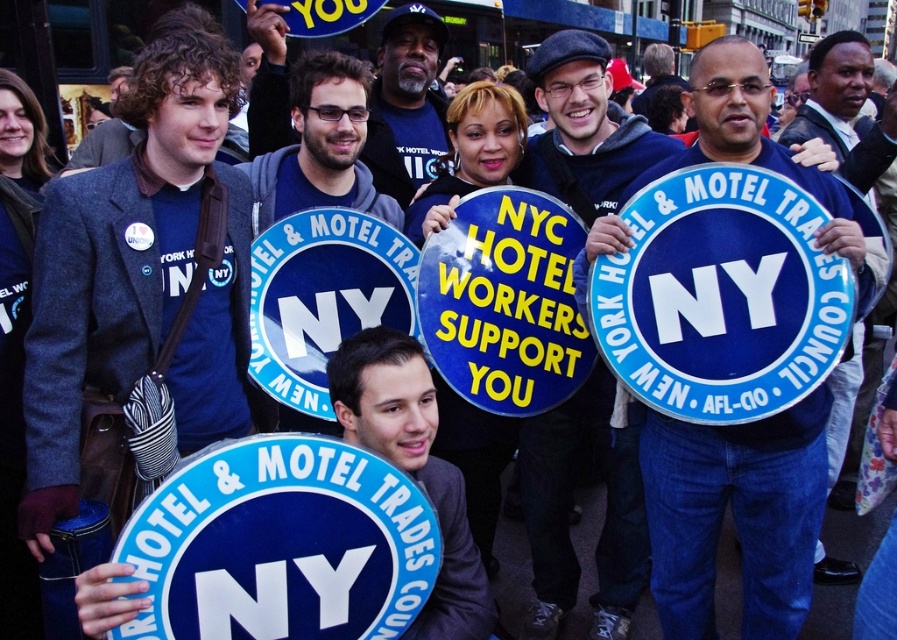
What are the coordinates of `blue matte sign at center` in the screenshot? It's located at (736, 515).

What do you see at coordinates (736, 515) in the screenshot? I see `blue matte sign at center` at bounding box center [736, 515].

Find the location of `blue matte sign at center`. blue matte sign at center is located at coordinates (736, 515).

Does point (802, 173) come closer to viewer compared to point (884, 145)?

That is True.

Can you confirm if blue matte sign at center is positioned to the left of blue fabric shirt at right?

Correct, you'll find blue matte sign at center to the left of blue fabric shirt at right.

At what (x,y) coordinates should I click in order to perform the action: click on blue matte sign at center. Please return your answer as a coordinate pair (x, y). This screenshot has width=897, height=640. Looking at the image, I should click on (736, 515).

Who is lower down, matte blue shirt at center or blue fabric shirt at right?

Positioned lower is matte blue shirt at center.

Can you confirm if matte blue shirt at center is positioned to the right of blue fabric shirt at right?

In fact, matte blue shirt at center is to the left of blue fabric shirt at right.

Which is behind, point (379, 205) or point (889, 96)?

Positioned behind is point (889, 96).

Identify the location of matte blue shirt at center. This screenshot has height=640, width=897. (321, 147).